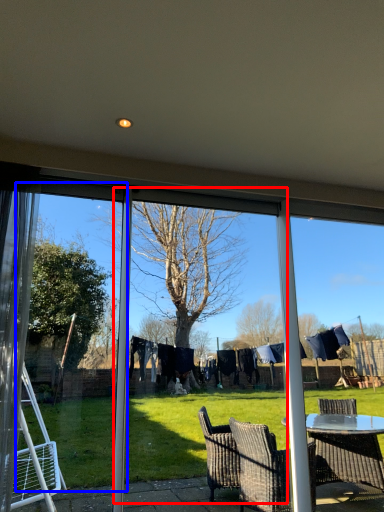
Question: Which object is closer to the camera taking this photo, screen door (highlighted by a red box) or screen door (highlighted by a blue box)?

Choices:
 (A) screen door
 (B) screen door

Answer: (B)